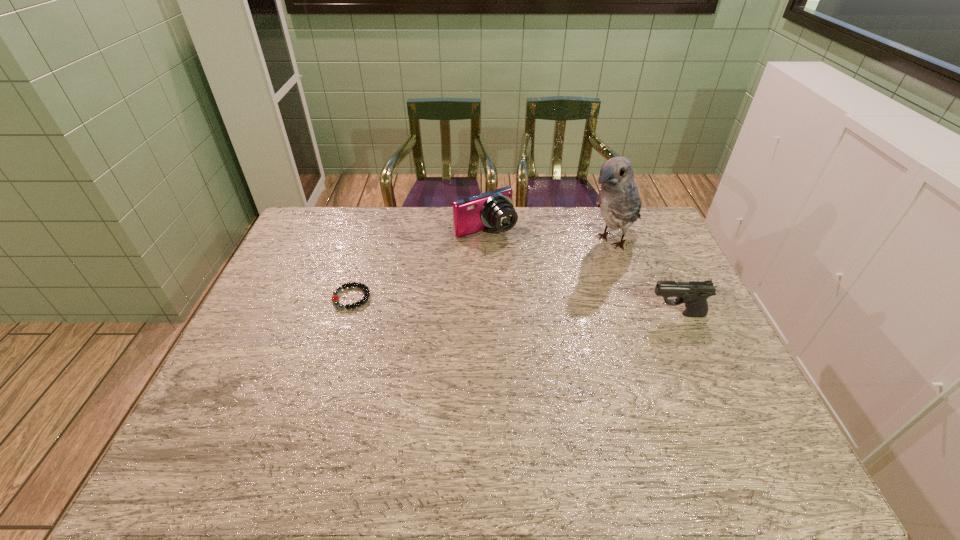
You are a GUI agent. You are given a task and a screenshot of the screen. Output one action in this format:
    pyautogui.click(x=<x>, y=<y>)
    Task: Click on the blank space located 0.370m on the front-facing side of the tallest object
    
    Given the screenshot: What is the action you would take?
    pyautogui.click(x=515, y=310)

You are a GUI agent. You are given a task and a screenshot of the screen. Output one action in this format:
    pyautogui.click(x=<x>, y=<y>)
    Task: Click on the vacant space located 0.250m on the front-facing side of the tallest object
    This screenshot has width=960, height=540.
    Given the screenshot: What is the action you would take?
    (541, 291)

Where is `free space located on the front-facing side of the camera`? free space located on the front-facing side of the camera is located at coordinates (513, 254).

Identify the location of vacant space located on the front-facing side of the camera. Image resolution: width=960 pixels, height=540 pixels. (524, 266).

Locate an element on the screen. The height and width of the screenshot is (540, 960). vacant space located 0.290m on the front-facing side of the camera is located at coordinates click(549, 293).

Where is `parrot at the far edge`? parrot at the far edge is located at coordinates (618, 199).

Where is `camera positioned at the far edge`? camera positioned at the far edge is located at coordinates (494, 209).

At what (x,y) coordinates should I click in order to perform the action: click on pistol positioned at the right edge. Please return your answer as a coordinate pair (x, y). Looking at the image, I should click on (694, 294).

Find the location of a particular element. parrot situated at the right edge is located at coordinates (618, 199).

This screenshot has width=960, height=540. In order to click on object situated at the far right corner in this screenshot , I will do `click(618, 199)`.